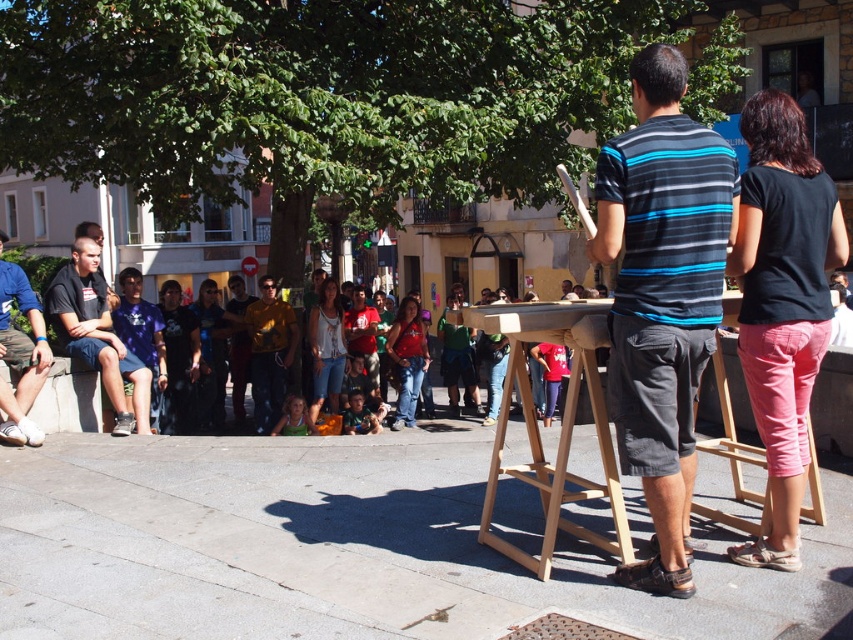
Question: Does striped cotton shirt at center have a greater width compared to yellow t-shirt at center?

Choices:
 (A) no
 (B) yes

Answer: (A)

Question: Does dark gray t-shirt at left appear on the left side of yellow t-shirt at center?

Choices:
 (A) yes
 (B) no

Answer: (A)

Question: Considering the real-world distances, which object is farthest from the wooden easel at center?

Choices:
 (A) matte black shorts at left
 (B) dark gray t-shirt at left

Answer: (A)

Question: Which point is farther to the camera?

Choices:
 (A) (585, 300)
 (B) (79, 497)

Answer: (A)

Question: Which of the following is the farthest from the observer?

Choices:
 (A) (550, 330)
 (B) (236, 419)
 (C) (624, 388)

Answer: (B)

Question: Is striped cotton shirt at center positioned at the back of matte black shirt at center?

Choices:
 (A) yes
 (B) no

Answer: (B)